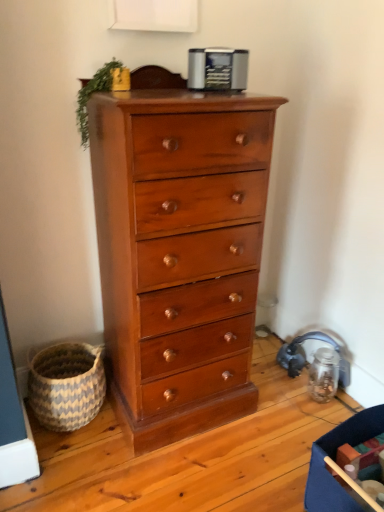
Question: Considering the relative sizes of blue and white woven basket at lower left and blue fabric storage box at lower right in the image provided, is blue and white woven basket at lower left bigger than blue fabric storage box at lower right?

Choices:
 (A) yes
 (B) no

Answer: (B)

Question: From the image's perspective, is blue and white woven basket at lower left on blue fabric storage box at lower right?

Choices:
 (A) no
 (B) yes

Answer: (B)

Question: Does blue and white woven basket at lower left have a greater height compared to blue fabric storage box at lower right?

Choices:
 (A) no
 (B) yes

Answer: (A)

Question: Is blue and white woven basket at lower left wider than blue fabric storage box at lower right?

Choices:
 (A) yes
 (B) no

Answer: (B)

Question: Does blue and white woven basket at lower left have a lesser width compared to blue fabric storage box at lower right?

Choices:
 (A) yes
 (B) no

Answer: (A)

Question: From a real-world perspective, is blue fabric storage box at lower right above or below metallic silver toaster at upper center?

Choices:
 (A) above
 (B) below

Answer: (B)

Question: Is blue fabric storage box at lower right taller or shorter than metallic silver toaster at upper center?

Choices:
 (A) short
 (B) tall

Answer: (B)

Question: Considering the positions of point (332, 504) and point (208, 65), is point (332, 504) closer or farther from the camera than point (208, 65)?

Choices:
 (A) closer
 (B) farther

Answer: (A)

Question: In terms of size, does blue fabric storage box at lower right appear bigger or smaller than metallic silver toaster at upper center?

Choices:
 (A) small
 (B) big

Answer: (B)

Question: Is point (82, 392) closer or farther from the camera than point (84, 101)?

Choices:
 (A) closer
 (B) farther

Answer: (B)

Question: Based on their positions, is blue and white woven basket at lower left located to the left or right of green leafy plant at top left?

Choices:
 (A) left
 (B) right

Answer: (A)

Question: Relative to green leafy plant at top left, is blue and white woven basket at lower left in front or behind?

Choices:
 (A) front
 (B) behind

Answer: (B)

Question: From a real-world perspective, is blue and white woven basket at lower left physically located above or below green leafy plant at top left?

Choices:
 (A) above
 (B) below

Answer: (B)

Question: Would you say metallic silver toaster at upper center is to the left or to the right of blue and white woven basket at lower left in the picture?

Choices:
 (A) left
 (B) right

Answer: (B)

Question: Relative to blue and white woven basket at lower left, is metallic silver toaster at upper center in front or behind?

Choices:
 (A) behind
 (B) front

Answer: (B)